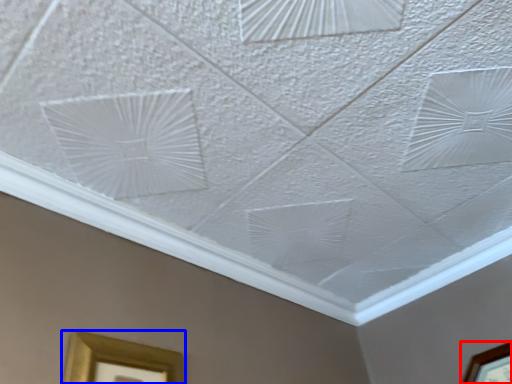
Question: Which of the following is the farthest to the observer, picture frame (highlighted by a red box) or picture frame (highlighted by a blue box)?

Choices:
 (A) picture frame
 (B) picture frame

Answer: (A)